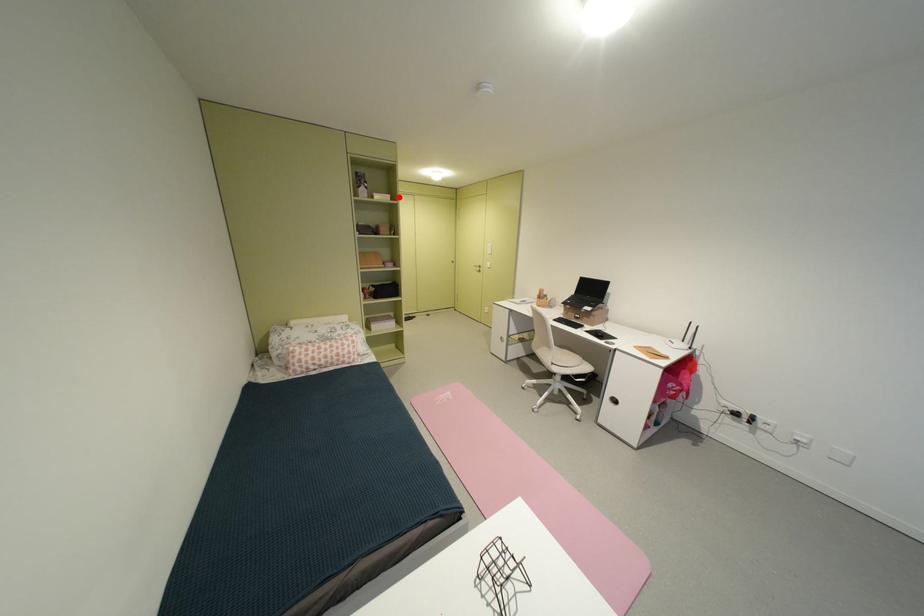
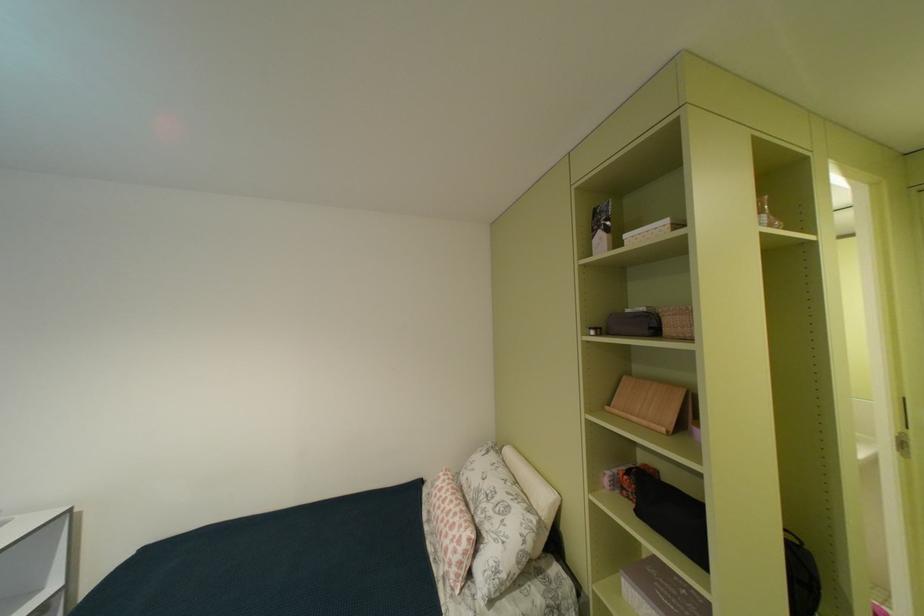
Question: I am providing you with two images of the same scene from different viewpoints. Image1 has a red point marked. In image2, the corresponding 3D location appears at what relative position? Reply with the corresponding letter.

Choices:
 (A) Closer
 (B) Farther

Answer: (B)